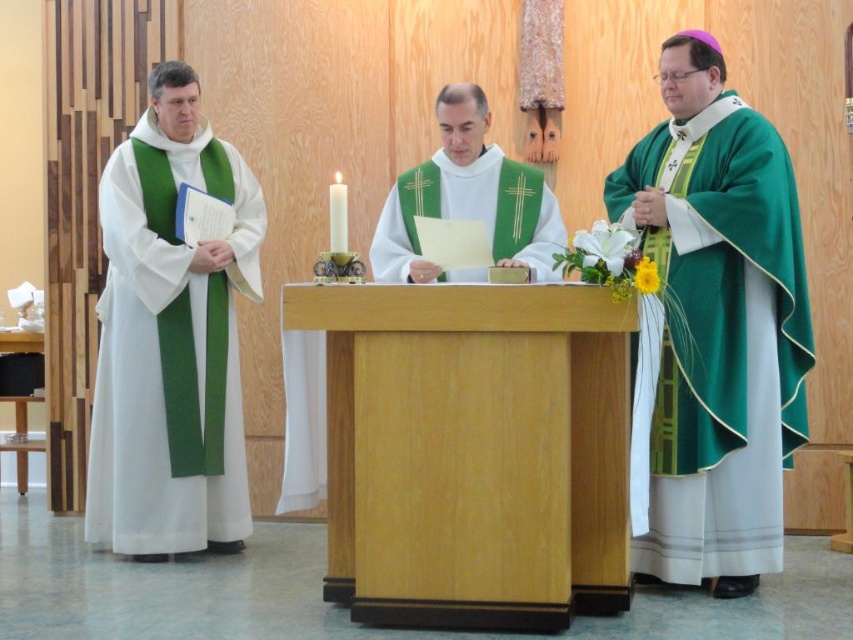
You are attending a religious ceremony and need to determine which of the two vestments is more narrow. You see the white matte vestment at left and the green satin vestment at center. Which one is thinner?

The white matte vestment at left is thinner than the green satin vestment at center according to the description.

You are an event planner arranging seating for a ceremony. You need to know which of the two clergy members, the one wearing the green satin robe at right or the one in the white matte vestment at left, requires a larger seating area due to their attire. Which one needs more space?

The green satin robe at right requires a larger seating area because it is bigger than the white matte vestment at left.

You are an attendee at the ceremony and want to know which clergy member is taller. Based on the description of their vestments, can you determine which is taller between the white matte vestment at left and the green satin vestment at center?

The white matte vestment at left has a greater height compared to the green satin vestment at center, so the clergy member wearing the white matte vestment at left is taller.